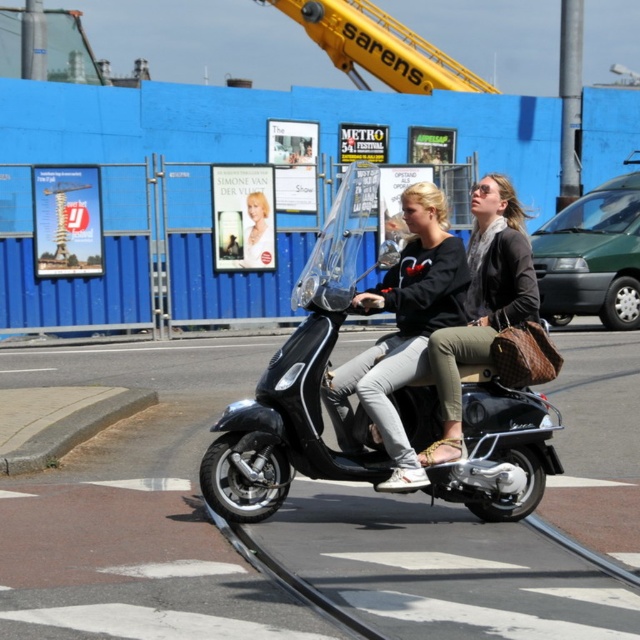
You are standing on the sidewalk and see the black matte sweatshirt at center and the matte black scooter at center. Which object is nearer to you?

The black matte sweatshirt at center is closer to the viewer than the matte black scooter at center.

You are standing at the point marked at coordinates (432, 496). The Vespa scooter is 7.71 meters away from you. If the scooter is moving towards the construction fence in the background, will it pass in front of or behind the fence?

The Vespa scooter is 7.71 meters away from the point marked at coordinates (432, 496). Since the scooter is moving towards the construction fence in the background, it will pass in front of the fence as it approaches the viewer from that direction.